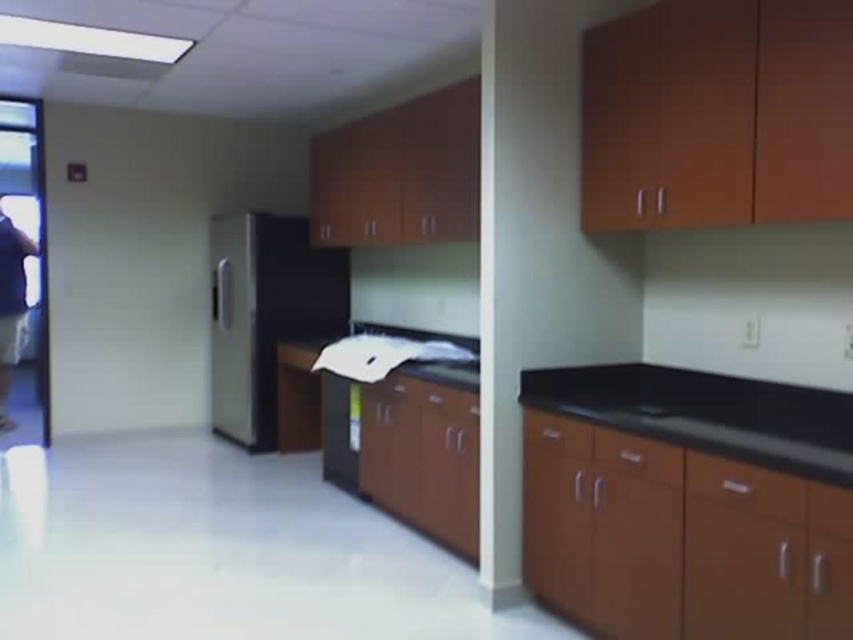
Question: Which point appears farthest from the camera in this image?

Choices:
 (A) (328, 308)
 (B) (18, 273)
 (C) (775, 385)

Answer: (B)

Question: Is satin black refrigerator at center to the left of dark blue shirt at left from the viewer's perspective?

Choices:
 (A) no
 (B) yes

Answer: (A)

Question: Is satin black refrigerator at center bigger than dark blue shirt at left?

Choices:
 (A) no
 (B) yes

Answer: (B)

Question: From the image, what is the correct spatial relationship of black granite countertop at center in relation to dark blue shirt at left?

Choices:
 (A) below
 (B) above

Answer: (A)

Question: Which of the following is the farthest from the observer?

Choices:
 (A) dark blue shirt at left
 (B) satin black refrigerator at center
 (C) black granite countertop at center

Answer: (A)

Question: Which object is positioned farthest from the black granite countertop at center?

Choices:
 (A) satin black refrigerator at center
 (B) dark blue shirt at left

Answer: (B)